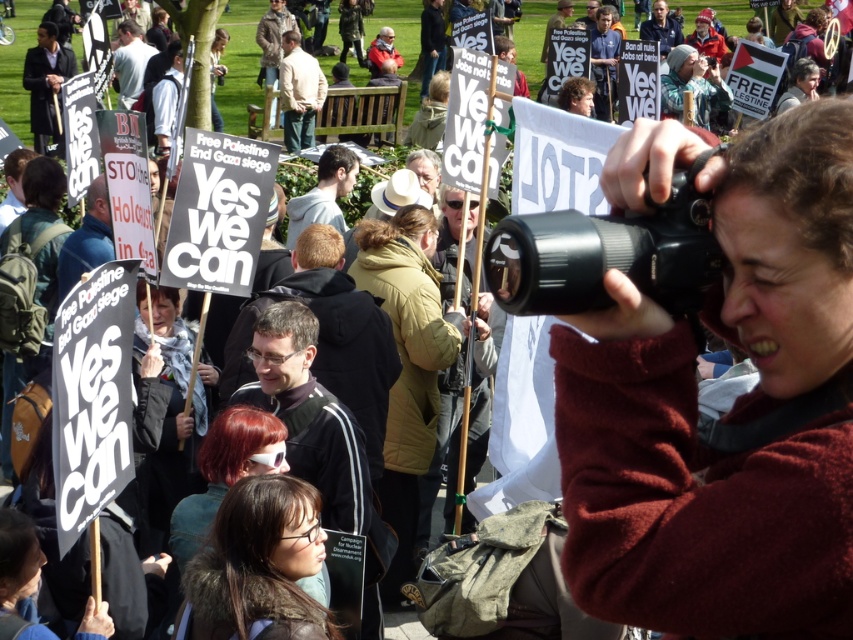
Question: Which is nearer to the dark brown hair at center?

Choices:
 (A) black plastic camera at upper right
 (B) maroon fleece at center

Answer: (B)

Question: Is green quilted jacket at center behind dark brown hair at center?

Choices:
 (A) no
 (B) yes

Answer: (B)

Question: Among these points, which one is nearest to the camera?

Choices:
 (A) tap(688, 205)
 (B) tap(202, 634)
 (C) tap(746, 296)

Answer: (C)

Question: Can you confirm if maroon fleece at center is smaller than green quilted jacket at center?

Choices:
 (A) yes
 (B) no

Answer: (A)

Question: Estimate the real-world distances between objects in this image. Which object is closer to the dark brown hair at center?

Choices:
 (A) maroon fleece at center
 (B) green quilted jacket at center

Answer: (A)

Question: Does green quilted jacket at center have a lesser width compared to dark brown hair at center?

Choices:
 (A) yes
 (B) no

Answer: (B)